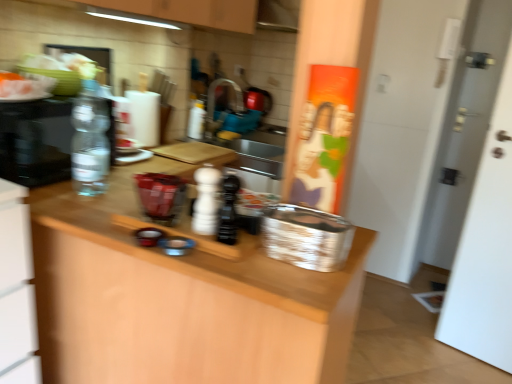
You are a GUI agent. You are given a task and a screenshot of the screen. Output one action in this format:
    pyautogui.click(x=<x>, y=<y>)
    Task: Click on the free spot to the left of transparent plastic bottle at left, acting as the third bottle starting from the front
    
    Given the screenshot: What is the action you would take?
    pyautogui.click(x=55, y=187)